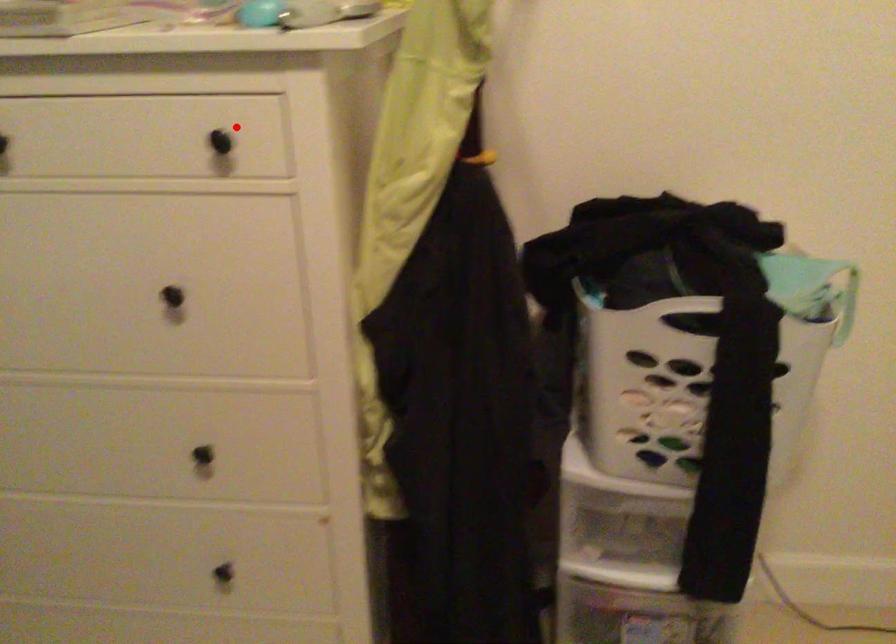
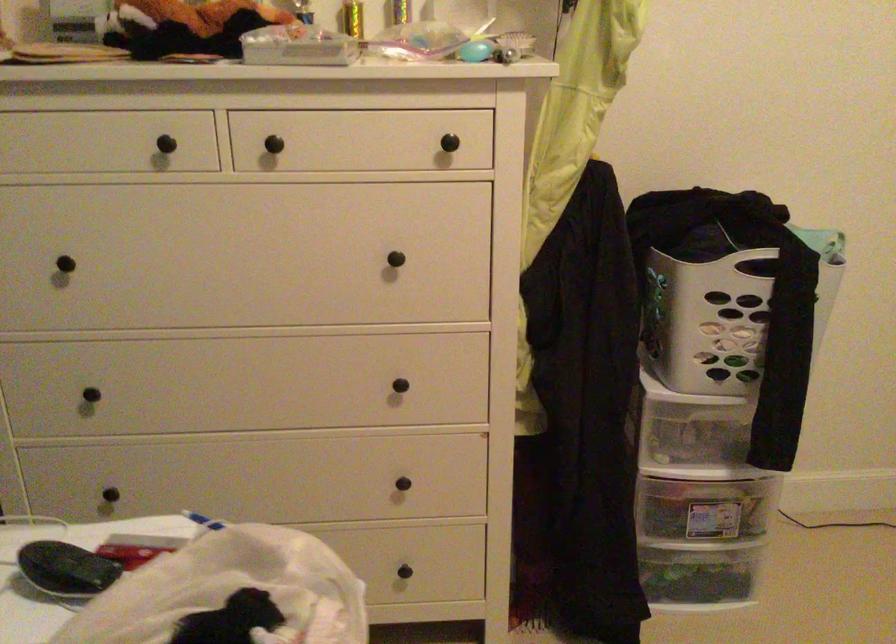
In the second image, find the point that corresponds to the highlighted location in the first image.

(453, 128)